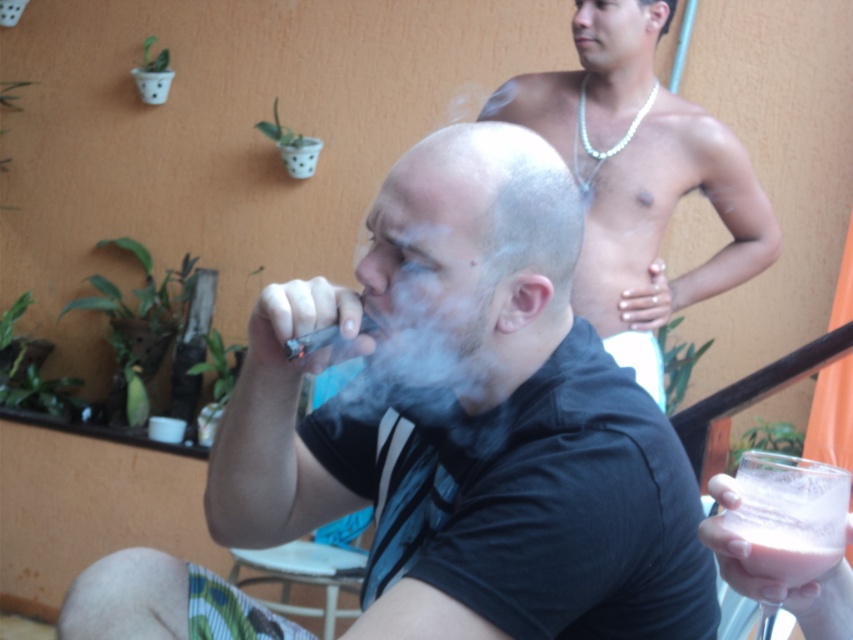
Question: Is shiny silver necklace at upper right thinner than pearl necklace at upper center?

Choices:
 (A) yes
 (B) no

Answer: (B)

Question: Does gray matte head at center have a greater width compared to white vapor at center?

Choices:
 (A) yes
 (B) no

Answer: (A)

Question: Which point is closer to the camera?

Choices:
 (A) (505, 154)
 (B) (792, 528)

Answer: (B)

Question: Which point is closer to the camera taking this photo?

Choices:
 (A) (613, 67)
 (B) (570, 234)

Answer: (B)

Question: Which point is closer to the camera?

Choices:
 (A) (392, 340)
 (B) (296, 467)

Answer: (A)

Question: Is gray matte head at center wider than shiny silver necklace at upper right?

Choices:
 (A) yes
 (B) no

Answer: (B)